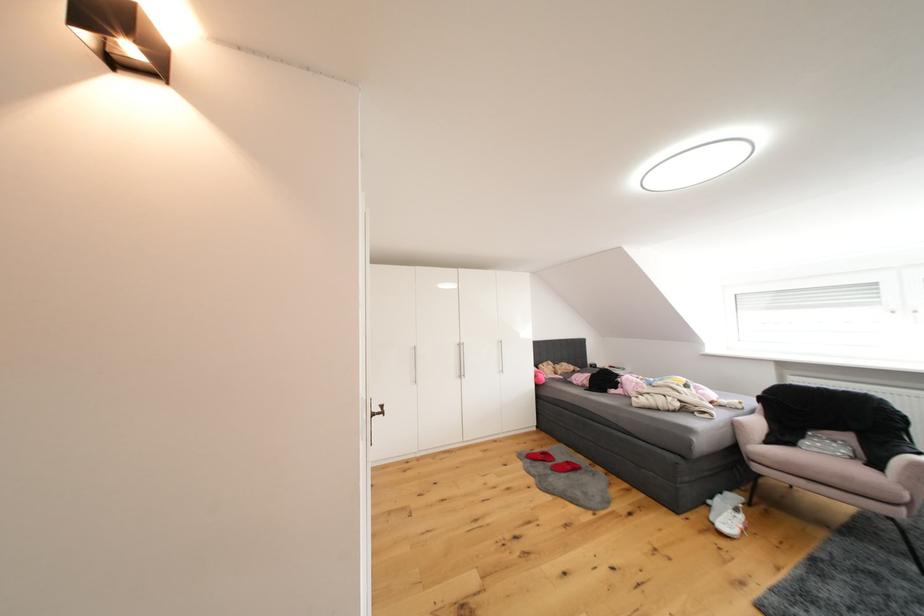
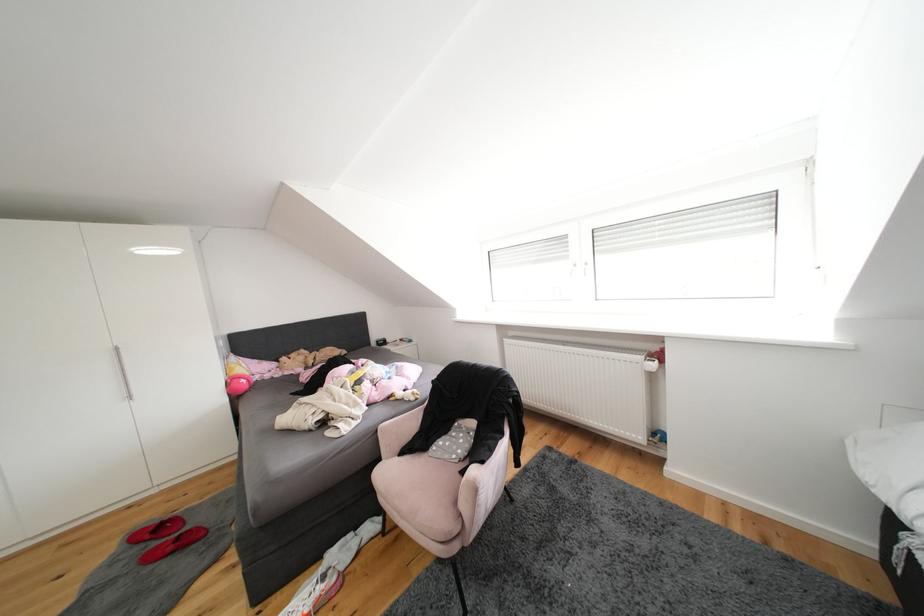
Question: The images are taken continuously from a first-person perspective. In which direction are you moving?

Choices:
 (A) Left
 (B) Right
 (C) Forward
 (D) Backward

Answer: (B)